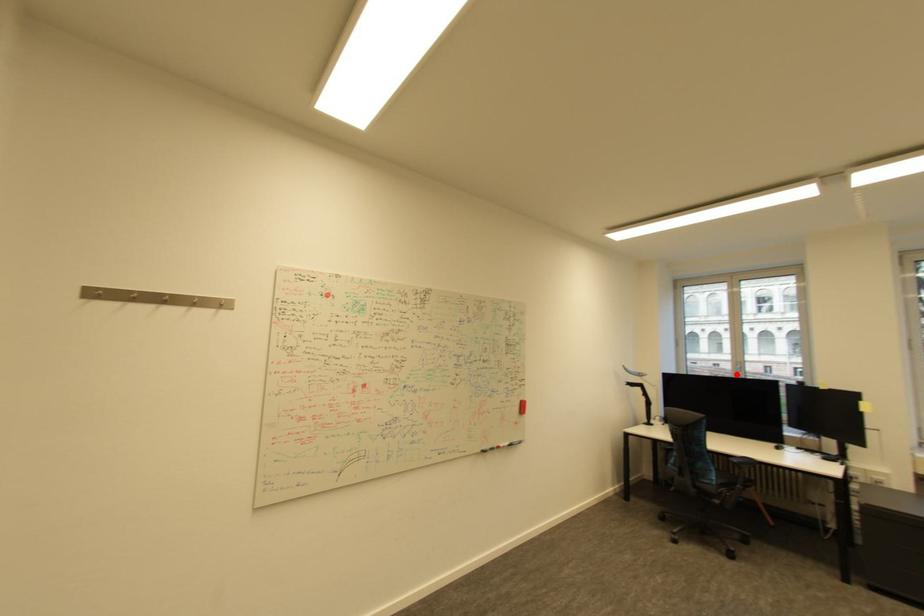
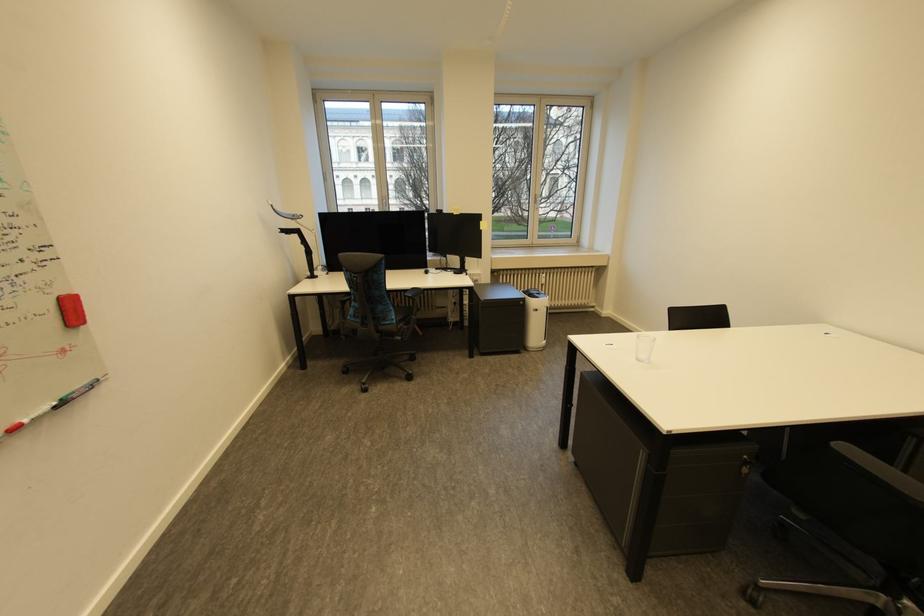
The point at the highlighted location is marked in the first image. Where is the corresponding point in the second image?

(383, 209)